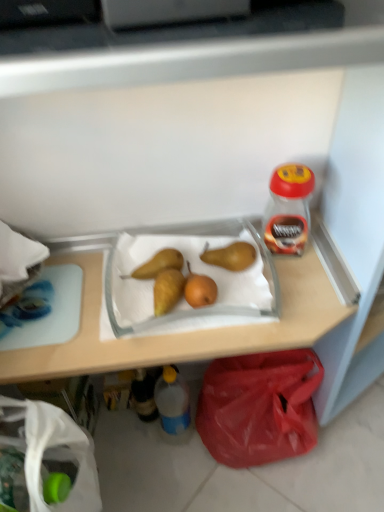
Question: Considering the positions of brown matte pear at center, positioned as the second pear in right-to-left order, and blue translucent bottle at lower center, placed as the first bottle when sorted from bottom to top, in the image, is brown matte pear at center, positioned as the second pear in right-to-left order, bigger or smaller than blue translucent bottle at lower center, placed as the first bottle when sorted from bottom to top,?

Choices:
 (A) big
 (B) small

Answer: (B)

Question: Would you say brown matte pear at center, positioned as the second pear in right-to-left order, is to the left or to the right of blue translucent bottle at lower center, the 2th bottle when ordered from right to left, in the picture?

Choices:
 (A) left
 (B) right

Answer: (A)

Question: Estimate the real-world distances between objects in this image. Which object is closer to the translucent plastic bottle at lower center, the 3th bottle positioned from the right?

Choices:
 (A) red plastic bag at lower right
 (B) yellow matte pears at center
 (C) translucent plastic jar at upper right, marked as the first bottle in a right-to-left arrangement
 (D) blue translucent bottle at lower center, the 2th bottle when ordered from right to left
 (E) brown matte pear at center, which appears as the second pear when viewed from the left

Answer: (D)

Question: Which of these objects is positioned closest to the blue translucent bottle at lower center, which is the third bottle in top-to-bottom order?

Choices:
 (A) translucent plastic jar at upper right, acting as the 1th bottle starting from the top
 (B) yellow matte pears at center
 (C) brown matte pear at center, acting as the first pear starting from the right
 (D) white fabric bag at lower left
 (E) red plastic bag at lower right

Answer: (E)